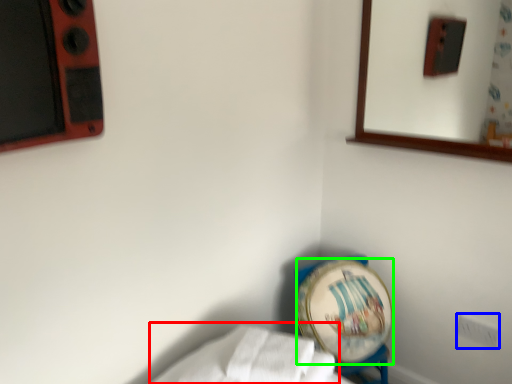
Question: Considering the real-world distances, which object is farthest from sheet (highlighted by a red box)? electric outlet (highlighted by a blue box) or platter (highlighted by a green box)?

Choices:
 (A) electric outlet
 (B) platter

Answer: (A)